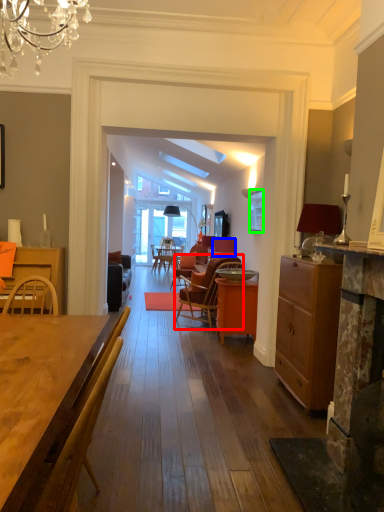
Question: Based on their relative distances, which object is nearer to chair (highlighted by a red box)? Choose from loudspeaker (highlighted by a blue box) and picture frame (highlighted by a green box).

Choices:
 (A) loudspeaker
 (B) picture frame

Answer: (A)